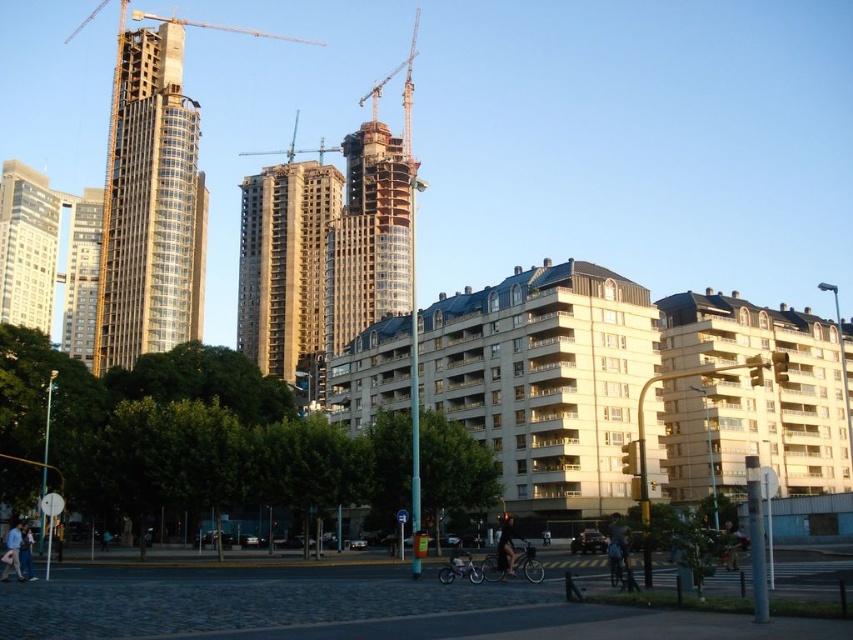
Question: Is gold glass building at center thinner than black matte bicycle at center?

Choices:
 (A) yes
 (B) no

Answer: (B)

Question: Which object is closer to the camera taking this photo?

Choices:
 (A) metallic construction crane at upper center
 (B) gold glass skyscraper at upper left
 (C) brown textured building at center
 (D) gold glass building at center

Answer: (C)

Question: Can you confirm if gold glass skyscraper at upper left is positioned below black matte bicycle at center?

Choices:
 (A) yes
 (B) no

Answer: (B)

Question: Which of the following is the closest to the observer?

Choices:
 (A) metallic construction crane at upper center
 (B) matte glass skyscraper at upper left
 (C) gold glass tower at center

Answer: (B)

Question: Which of the following is the farthest from the observer?

Choices:
 (A) matte glass skyscraper at upper left
 (B) gold glass skyscraper at upper left
 (C) metallic construction crane at upper center

Answer: (C)

Question: Does gold glass building at center come in front of metallic blue crane at center?

Choices:
 (A) yes
 (B) no

Answer: (A)